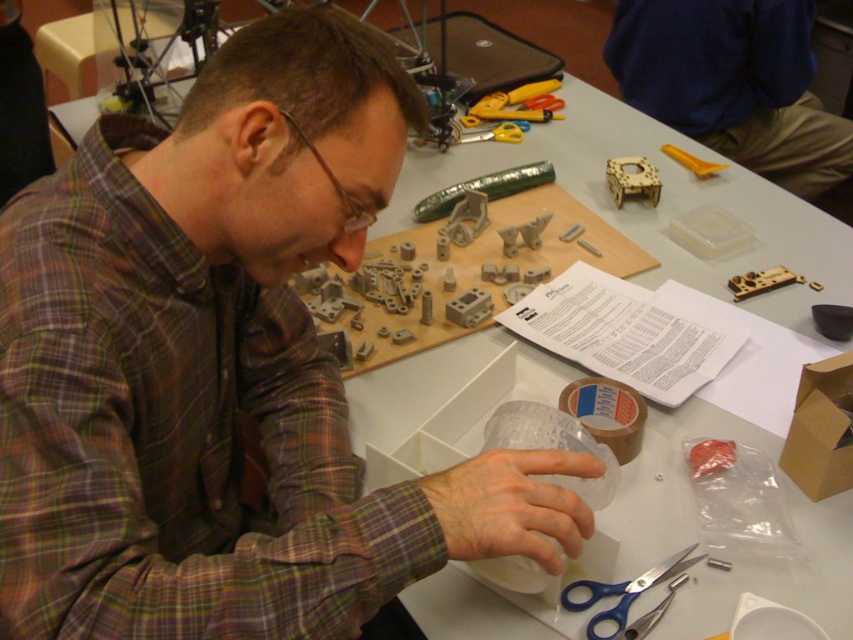
You are trying to locate the wooden puzzle piece at upper right and the metallic gold gear at upper right on the table. Based on their positions, which one is closer to the right edge of the table?

The wooden puzzle piece at upper right is to the right of the metallic gold gear at upper right, so the wooden puzzle piece at upper right is closer to the right edge of the table.

You are trying to fit the wooden puzzle piece at upper right into a slot that is the same size as the metallic gold gear at upper right. Will it fit?

The wooden puzzle piece at upper right is wider than the metallic gold gear at upper right, so it won